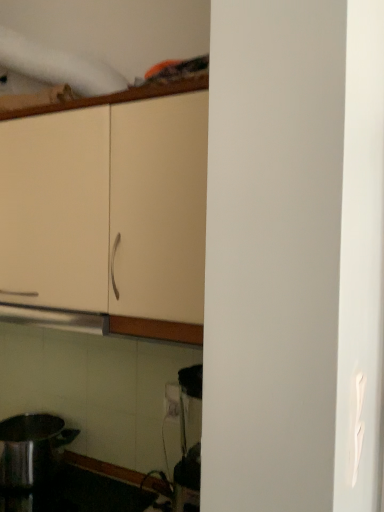
Question: Is matte cream cabinet at upper left thinner than shiny metallic pot at lower left?

Choices:
 (A) yes
 (B) no

Answer: (B)

Question: Considering the relative sizes of matte cream cabinet at upper left and shiny metallic pot at lower left in the image provided, is matte cream cabinet at upper left bigger than shiny metallic pot at lower left?

Choices:
 (A) no
 (B) yes

Answer: (B)

Question: Considering the relative sizes of matte cream cabinet at upper left and shiny metallic pot at lower left in the image provided, is matte cream cabinet at upper left shorter than shiny metallic pot at lower left?

Choices:
 (A) yes
 (B) no

Answer: (B)

Question: Is matte cream cabinet at upper left closer to camera compared to shiny metallic pot at lower left?

Choices:
 (A) no
 (B) yes

Answer: (B)

Question: Can you confirm if matte cream cabinet at upper left is taller than shiny metallic pot at lower left?

Choices:
 (A) yes
 (B) no

Answer: (A)

Question: Is matte cream cabinet at upper left positioned far away from shiny metallic pot at lower left?

Choices:
 (A) yes
 (B) no

Answer: (B)

Question: Is shiny metallic pot at lower left wider than matte cream cabinet at upper left?

Choices:
 (A) no
 (B) yes

Answer: (A)

Question: Considering the relative sizes of shiny metallic pot at lower left and matte cream cabinet at upper left in the image provided, is shiny metallic pot at lower left smaller than matte cream cabinet at upper left?

Choices:
 (A) no
 (B) yes

Answer: (B)

Question: Considering the relative sizes of shiny metallic pot at lower left and matte cream cabinet at upper left in the image provided, is shiny metallic pot at lower left taller than matte cream cabinet at upper left?

Choices:
 (A) yes
 (B) no

Answer: (B)

Question: From the image's perspective, is shiny metallic pot at lower left below matte cream cabinet at upper left?

Choices:
 (A) yes
 (B) no

Answer: (A)

Question: Is shiny metallic pot at lower left at the right side of matte cream cabinet at upper left?

Choices:
 (A) no
 (B) yes

Answer: (A)

Question: From a real-world perspective, is shiny metallic pot at lower left on top of matte cream cabinet at upper left?

Choices:
 (A) no
 (B) yes

Answer: (A)

Question: In the image, is matte cream cabinet at upper left positioned in front of or behind shiny metallic pot at lower left?

Choices:
 (A) behind
 (B) front

Answer: (B)